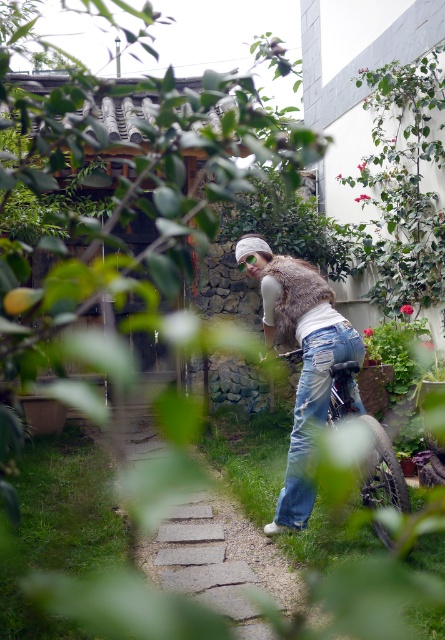
Is point (307, 392) closer to camera compared to point (327, 333)?

No, (307, 392) is further to viewer.

Does fur vest at center have a lesser height compared to denim jeans at center?

No.

Locate an element on the screen. This screenshot has height=640, width=445. fur vest at center is located at coordinates (303, 356).

Is stone paved path at center above fur vest at center?

No, stone paved path at center is not above fur vest at center.

Does stone paved path at center have a greater height compared to fur vest at center?

Incorrect, stone paved path at center's height is not larger of fur vest at center's.

Does point (201, 596) come farther from viewer compared to point (295, 500)?

No, (201, 596) is closer to viewer.

Identify the location of stone paved path at center. (222, 563).

Does stone paved path at center have a lesser height compared to denim jeans at center?

Yes, stone paved path at center is shorter than denim jeans at center.

Find the location of a particular element. The width and height of the screenshot is (445, 640). stone paved path at center is located at coordinates (222, 563).